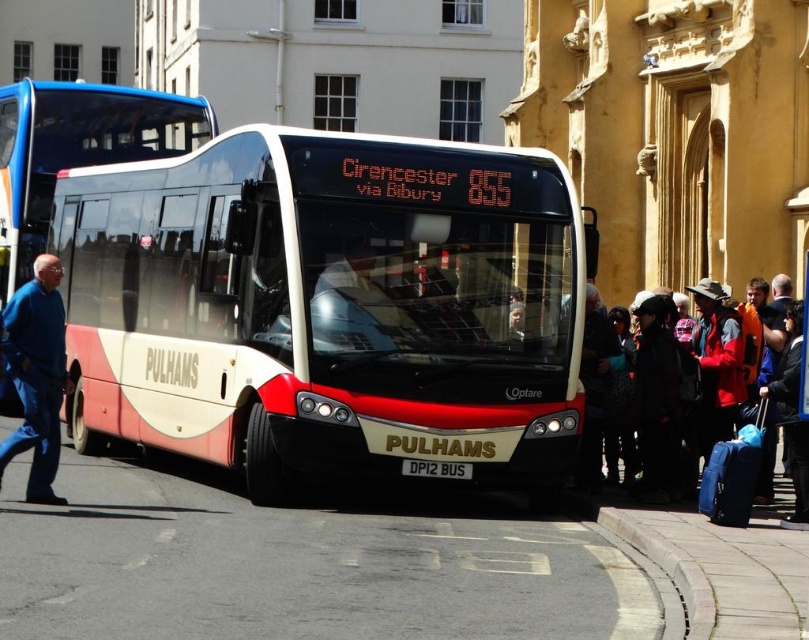
Consider the image. You are a delivery person who needs to place a package between the blue jeans at left and the blue fabric suitcase at right. The package requires a minimum of 7 meters of space. Can you fit the package between them?

The blue jeans at left and blue fabric suitcase at right are 8.15 meters apart, so yes, the package can fit between them since the distance is more than the required 7 meters.

You are standing in the town square and see the modern bus with the destination sign. There are also blue jeans at left. What is the spatial relationship between the blue jeans and the bus?

The blue jeans at left is located at point (36,374), which is to the left side of the bus in the image.

You are standing at the center of the image and want to walk to the white concrete curb at lower right. In which direction should you move relative to your current position?

You should move towards the lower right direction to reach the white concrete curb at lower right.